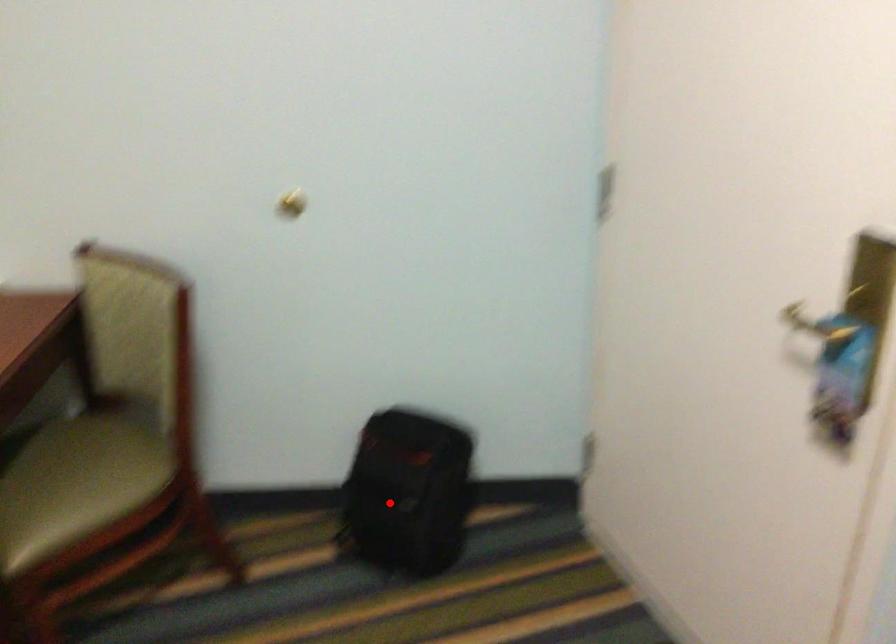
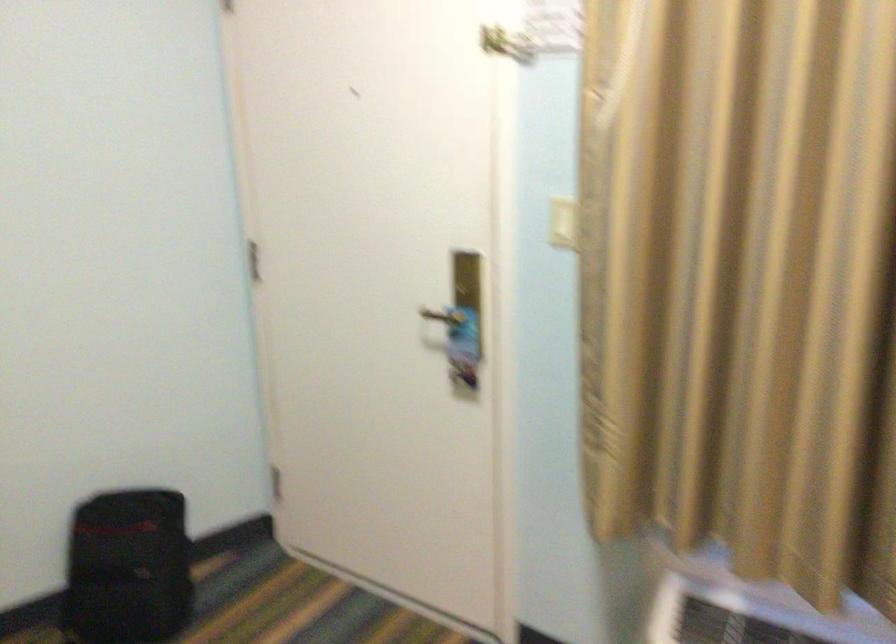
Find the pixel in the second image that matches the highlighted location in the first image.

(128, 567)